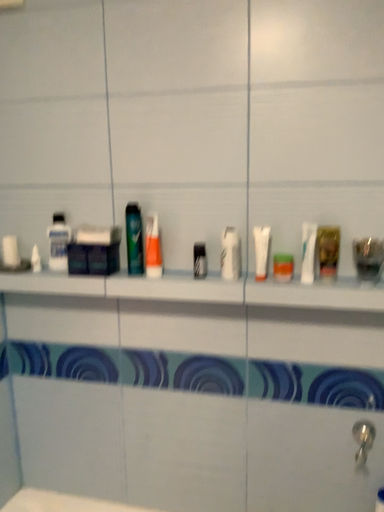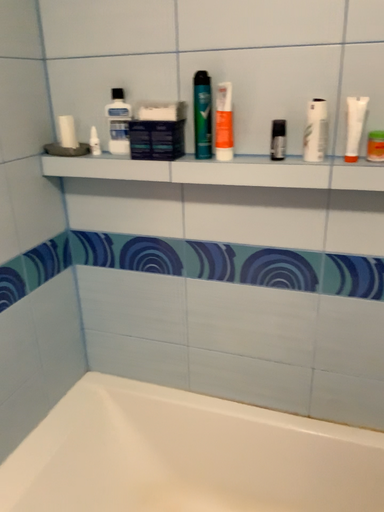
Question: Which way did the camera rotate in the video?

Choices:
 (A) rotated downward
 (B) rotated upward

Answer: (A)